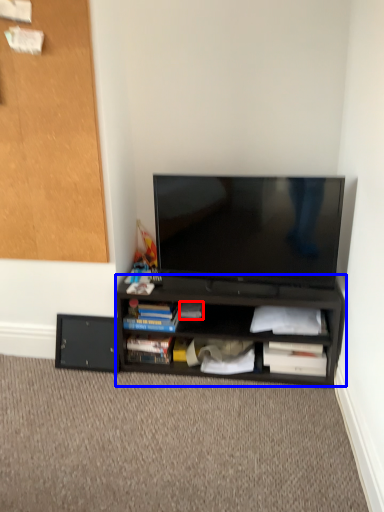
Question: Which point is further to the camera, book (highlighted by a red box) or desk (highlighted by a blue box)?

Choices:
 (A) book
 (B) desk

Answer: (A)